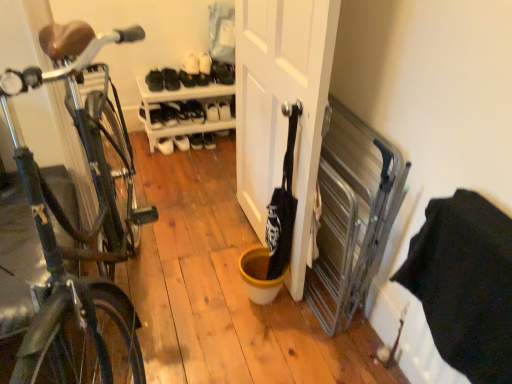
Question: Can you see white matte sneakers at upper center touching white fabric shoe at upper center, which is the third shoe from left to right?

Choices:
 (A) yes
 (B) no

Answer: (B)

Question: From a real-world perspective, is white matte sneakers at upper center positioned under white fabric shoe at upper center, marked as the 5th shoe in a right-to-left arrangement, based on gravity?

Choices:
 (A) yes
 (B) no

Answer: (A)

Question: From the image's perspective, is white matte sneakers at upper center on white fabric shoe at upper center, which is the third shoe from left to right?

Choices:
 (A) no
 (B) yes

Answer: (A)

Question: Is white matte sneakers at upper center taller than white fabric shoe at upper center, marked as the 5th shoe in a right-to-left arrangement?

Choices:
 (A) no
 (B) yes

Answer: (A)

Question: Is white matte sneakers at upper center surrounding white fabric shoe at upper center, which is the third shoe from left to right?

Choices:
 (A) no
 (B) yes

Answer: (A)

Question: Does white matte sneakers at upper center have a smaller size compared to white fabric shoe at upper center, which is the third shoe from left to right?

Choices:
 (A) no
 (B) yes

Answer: (B)

Question: Is white matte shoe at upper center, the first shoe viewed from the right, aimed at white leather shoe at center?

Choices:
 (A) yes
 (B) no

Answer: (B)

Question: Is white matte shoe at upper center, marked as the seventh shoe in a left-to-right arrangement, placed right next to white leather shoe at center?

Choices:
 (A) yes
 (B) no

Answer: (B)

Question: From the image's perspective, is white matte shoe at upper center, marked as the seventh shoe in a left-to-right arrangement, below white leather shoe at center?

Choices:
 (A) no
 (B) yes

Answer: (A)

Question: Does white matte shoe at upper center, the first shoe viewed from the right, have a lesser height compared to white leather shoe at center?

Choices:
 (A) no
 (B) yes

Answer: (A)

Question: Does white matte shoe at upper center, the first shoe viewed from the right, contain white leather shoe at center?

Choices:
 (A) yes
 (B) no

Answer: (B)

Question: Is white matte shoe at upper center, marked as the seventh shoe in a left-to-right arrangement, located outside white leather shoe at center?

Choices:
 (A) yes
 (B) no

Answer: (A)

Question: Can you confirm if white leather shoe at center, which appears as the 7th shoe when viewed from the right, is shorter than white matte door at center?

Choices:
 (A) yes
 (B) no

Answer: (A)